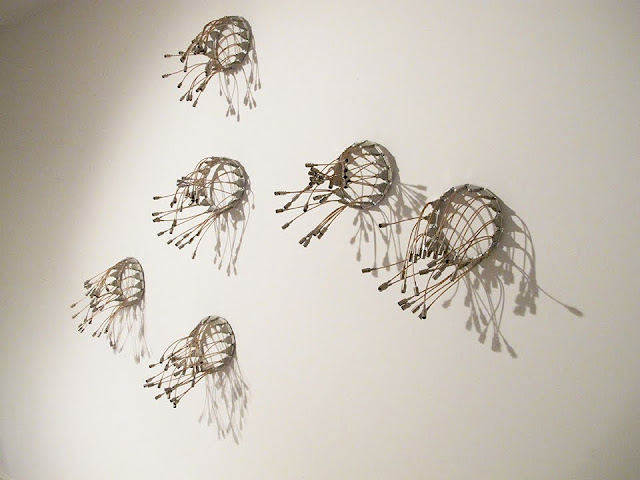
What are the coordinates of `contemporary art display` in the screenshot? It's located at 288,264.